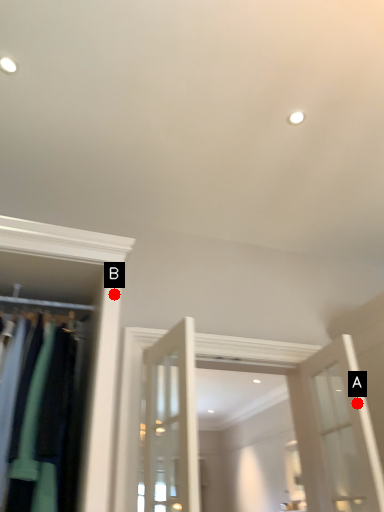
Question: Two points are circled on the image, labeled by A and B beside each circle. Among these points, which one is farthest from the camera?

Choices:
 (A) A is further
 (B) B is further

Answer: (A)